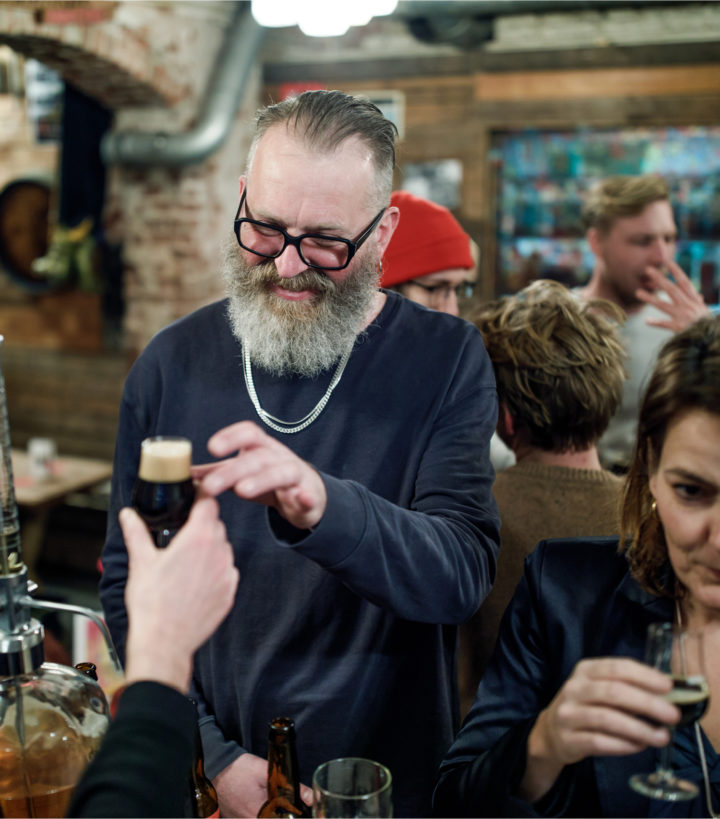
Identify the location of coupe glass. The width and height of the screenshot is (720, 819). (687, 721).